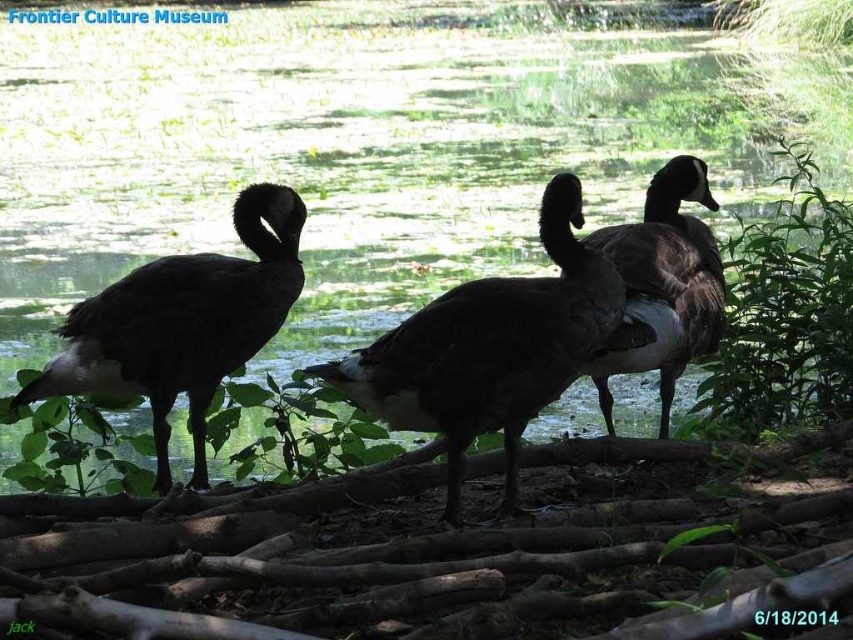
Between dark glossy goose at center and dark brown feathers at left, which one has less height?

Standing shorter between the two is dark glossy goose at center.

Based on the photo, between dark glossy goose at center and dark brown feathers at left, which one is positioned lower?

dark brown feathers at left

Find the location of a particular element. dark glossy goose at center is located at coordinates (489, 348).

Which of these two, dark glossy goose at center or dark brown feathers at center, stands shorter?

dark glossy goose at center

Between dark glossy goose at center and dark brown feathers at center, which one appears on the left side from the viewer's perspective?

Positioned to the left is dark glossy goose at center.

Where is `dark glossy goose at center`? The height and width of the screenshot is (640, 853). dark glossy goose at center is located at coordinates (489, 348).

Locate an element on the screen. dark glossy goose at center is located at coordinates (489, 348).

Is dark brown feathers at left wider than dark brown feathers at center?

Indeed, dark brown feathers at left has a greater width compared to dark brown feathers at center.

Does dark brown feathers at left appear over dark brown feathers at center?

Actually, dark brown feathers at left is below dark brown feathers at center.

Between point (120, 387) and point (706, 342), which one is positioned behind?

Positioned behind is point (706, 342).

This screenshot has width=853, height=640. I want to click on dark brown feathers at left, so click(183, 323).